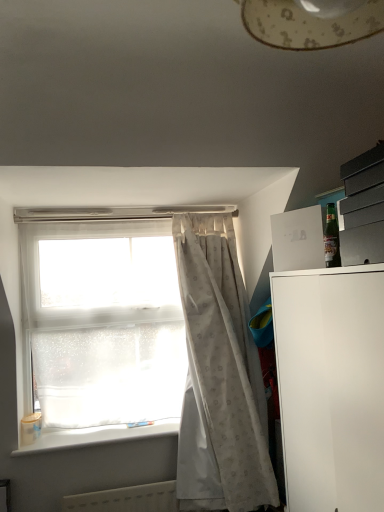
Question: Relative to white matte/file cabinet at right, is transparent plastic window at upper left in front or behind?

Choices:
 (A) front
 (B) behind

Answer: (B)

Question: Is transparent plastic window at upper left to the left or to the right of white matte/file cabinet at right in the image?

Choices:
 (A) left
 (B) right

Answer: (A)

Question: Considering the real-world distances, which object is farthest from the white plastic window sill at lower left?

Choices:
 (A) white plastic radiator at lower center
 (B) transparent plastic window at upper left
 (C) white matte/file cabinet at right
 (D) green glass bottle at upper right
 (E) white textured curtain at center

Answer: (D)

Question: Considering the real-world distances, which object is farthest from the green glass bottle at upper right?

Choices:
 (A) white plastic radiator at lower center
 (B) white matte/file cabinet at right
 (C) white plastic window sill at lower left
 (D) transparent plastic window at upper left
 (E) white textured curtain at center

Answer: (A)